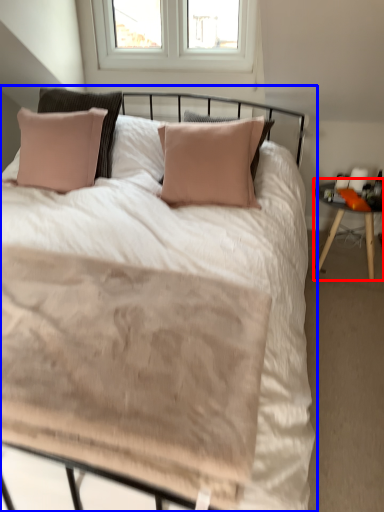
Question: Which object is further to the camera taking this photo, nightstand (highlighted by a red box) or bed (highlighted by a blue box)?

Choices:
 (A) nightstand
 (B) bed

Answer: (A)